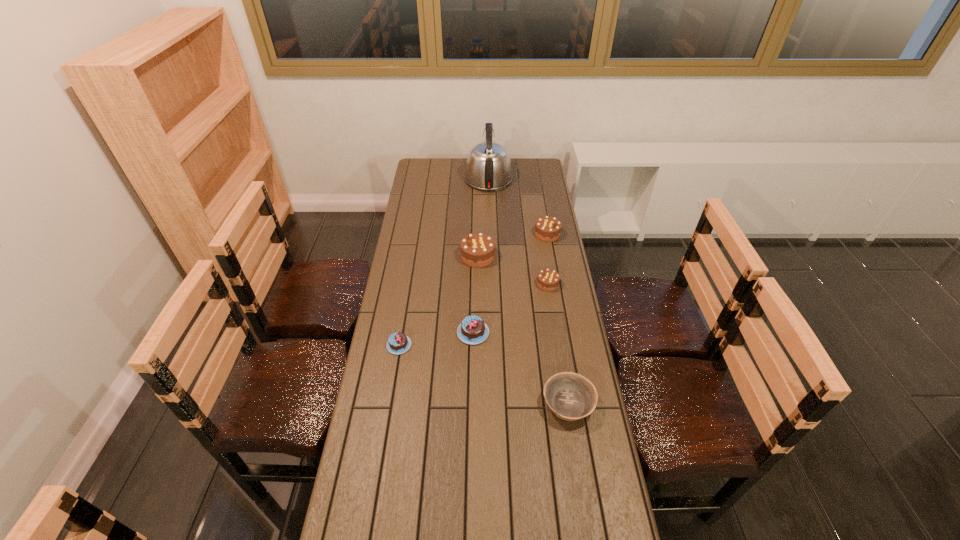
You are a GUI agent. You are given a task and a screenshot of the screen. Output one action in this format:
    pyautogui.click(x=<x>, y=<y>)
    Task: Click on the object that is positioned at the left edge
    
    Given the screenshot: What is the action you would take?
    pyautogui.click(x=398, y=343)

At what (x,y) coordinates should I click in order to perform the action: click on bowl that is positioned at the right edge. Please return your answer as a coordinate pair (x, y). The width and height of the screenshot is (960, 540). Looking at the image, I should click on (570, 396).

You are a GUI agent. You are given a task and a screenshot of the screen. Output one action in this format:
    pyautogui.click(x=<x>, y=<y>)
    Task: Click on the free space at the far edge of the desktop
    
    Given the screenshot: What is the action you would take?
    pyautogui.click(x=465, y=161)

Where is `free space at the left edge of the desktop`? The height and width of the screenshot is (540, 960). free space at the left edge of the desktop is located at coordinates (396, 252).

This screenshot has height=540, width=960. I want to click on vacant region at the right edge of the desktop, so click(558, 260).

This screenshot has width=960, height=540. I want to click on vacant space at the far left corner, so click(x=427, y=170).

Identify the location of free point between the bigger pink chocolate cake and the leftmost object. The width and height of the screenshot is (960, 540). (436, 339).

Locate an element on the screen. The width and height of the screenshot is (960, 540). free space between the right pink chocolate cake and the smallest brown chocolate cake is located at coordinates (511, 308).

Find the location of a particular element. This screenshot has width=960, height=540. free spot between the gray kettle and the nearest brown chocolate cake is located at coordinates (518, 231).

This screenshot has height=540, width=960. Identify the location of vacant area between the third nearest chocolate cake and the bowl. (558, 344).